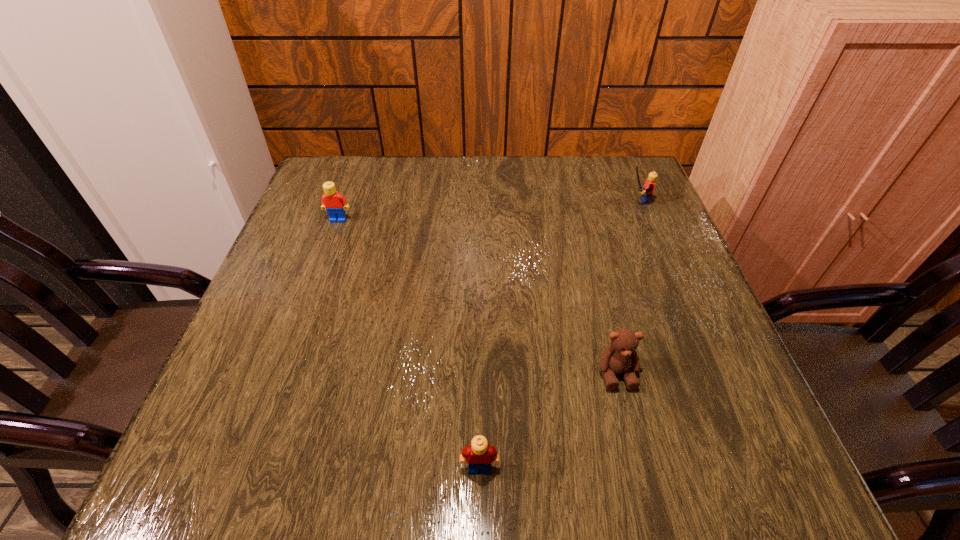
In order to click on free space between the farthest object and the leftmost object in this screenshot , I will do `click(488, 211)`.

You are a GUI agent. You are given a task and a screenshot of the screen. Output one action in this format:
    pyautogui.click(x=<x>, y=<y>)
    Task: Click on the unoccupied position between the rightmost Lego and the third object from right to left
    
    Given the screenshot: What is the action you would take?
    pyautogui.click(x=558, y=334)

Where is `free point between the farthest object and the shortest Lego`? The image size is (960, 540). free point between the farthest object and the shortest Lego is located at coordinates coord(558,334).

The image size is (960, 540). I want to click on free area in between the second Lego from right to left and the second nearest object, so click(x=548, y=420).

At what (x,y) coordinates should I click in order to perform the action: click on the third closest object relative to the second Lego from right to left. Please return your answer as a coordinate pair (x, y). Looking at the image, I should click on (646, 193).

In order to click on object identified as the second closest to the nearest object in this screenshot , I will do `click(335, 204)`.

Select which Lego appears as the closest to the rightmost object. Please provide its 2D coordinates. Your answer should be formatted as a tuple, i.e. [(x, y)], where the tuple contains the x and y coordinates of a point satisfying the conditions above.

[(335, 204)]

Select which Lego is the second closest to the leftmost object. Please provide its 2D coordinates. Your answer should be formatted as a tuple, i.e. [(x, y)], where the tuple contains the x and y coordinates of a point satisfying the conditions above.

[(646, 193)]

Identify the location of free spot that satisfies the following two spatial constraints: 1. on the front-facing side of the farthest Lego; 2. on the front-facing side of the second Lego from right to left. This screenshot has width=960, height=540. (745, 468).

I want to click on free spot that satisfies the following two spatial constraints: 1. on the front-facing side of the rightmost object; 2. on the front-facing side of the second object from left to right, so click(745, 468).